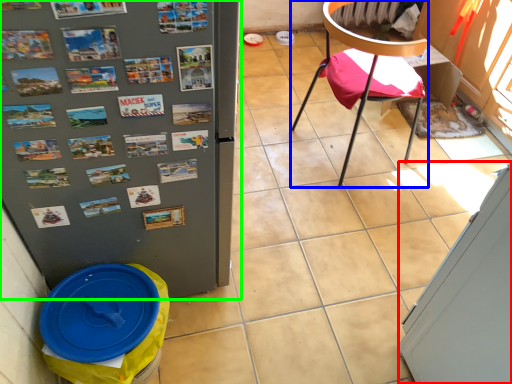
Question: Based on their relative distances, which object is nearer to screen door (highlighted by a red box)? Choose from chair (highlighted by a blue box) and refrigerator (highlighted by a green box).

Choices:
 (A) chair
 (B) refrigerator

Answer: (B)